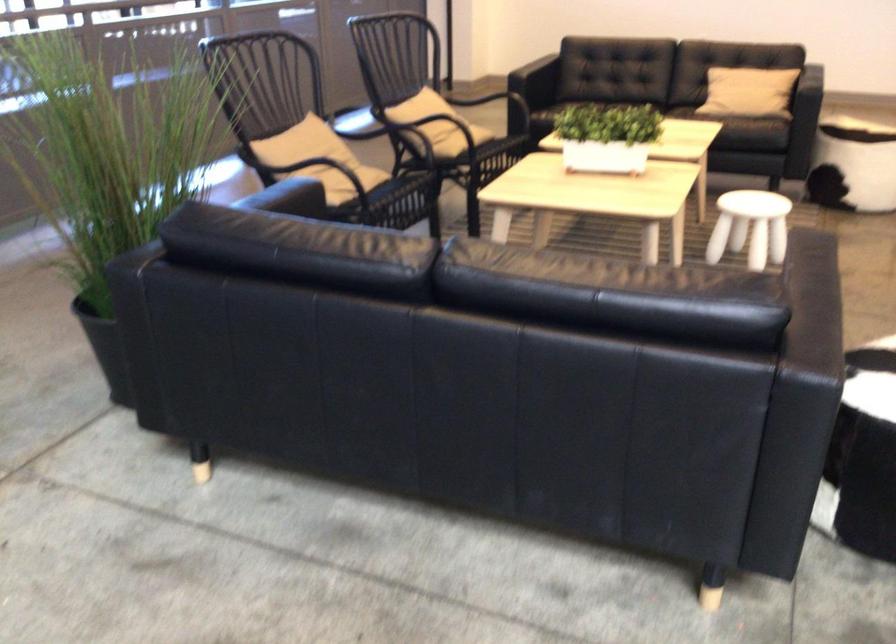
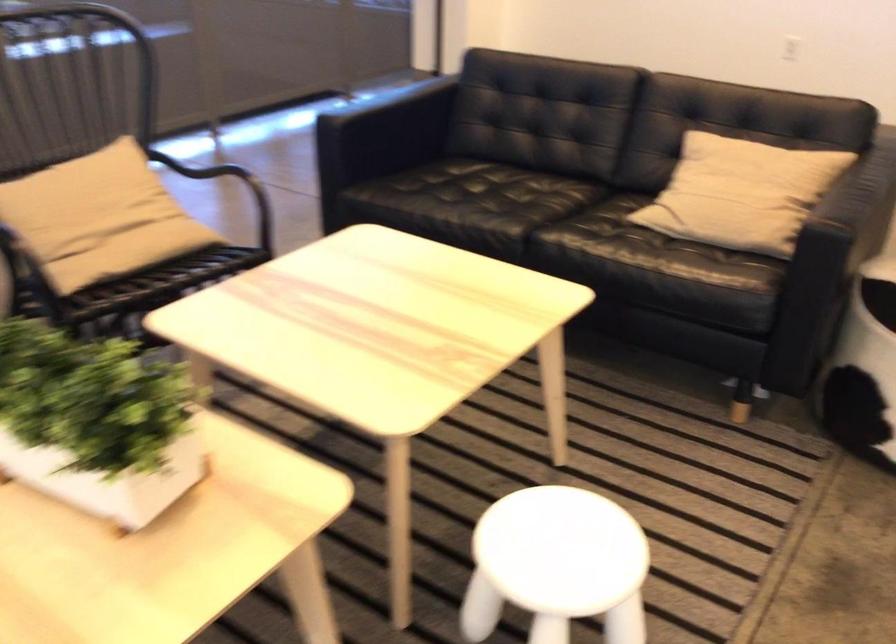
The point at (453, 111) is marked in the first image. Where is the corresponding point in the second image?

(99, 214)